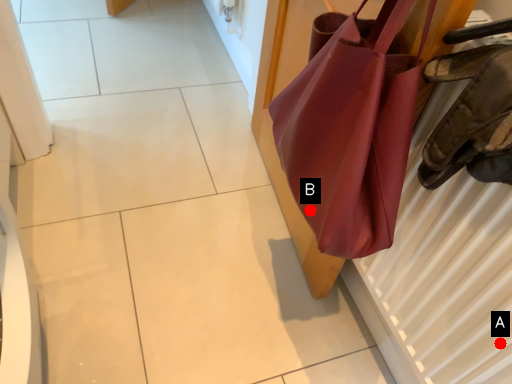
Question: Two points are circled on the image, labeled by A and B beside each circle. Which point appears farthest from the camera in this image?

Choices:
 (A) A is further
 (B) B is further

Answer: (B)